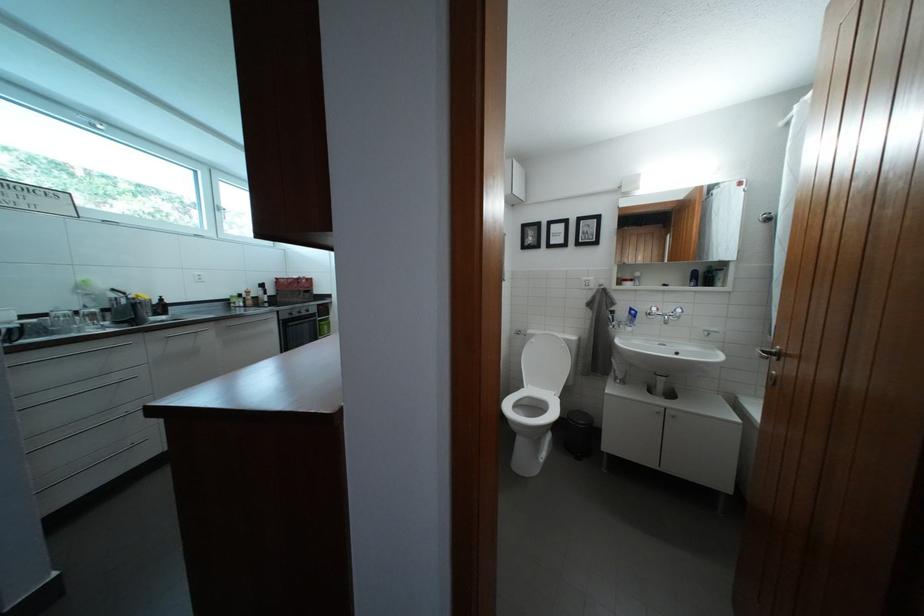
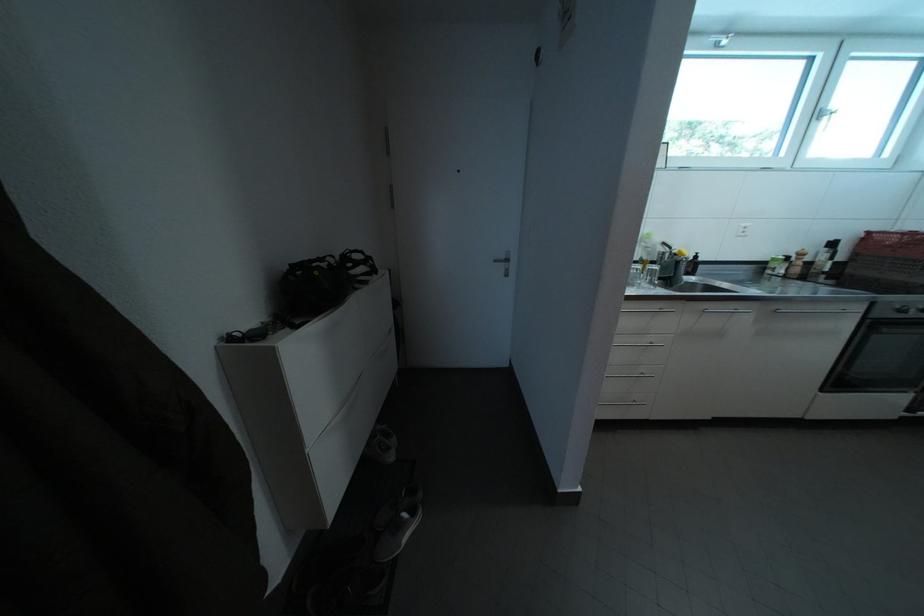
The first image is from the beginning of the video and the second image is from the end. How did the camera likely rotate when shooting the video?

The camera's rotation is toward left-down.